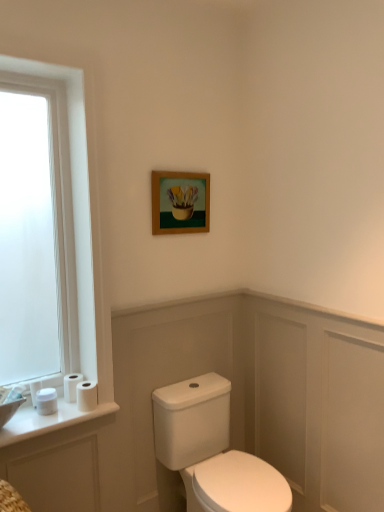
Question: Considering the relative positions of wooden frame at upper center and white glossy porcelain at center in the image provided, is wooden frame at upper center in front of white glossy porcelain at center?

Choices:
 (A) yes
 (B) no

Answer: (B)

Question: Is wooden frame at upper center not near white glossy porcelain at center?

Choices:
 (A) yes
 (B) no

Answer: (B)

Question: Is wooden frame at upper center oriented away from white glossy porcelain at center?

Choices:
 (A) yes
 (B) no

Answer: (B)

Question: Can you confirm if wooden frame at upper center is positioned to the right of white glossy porcelain at center?

Choices:
 (A) no
 (B) yes

Answer: (A)

Question: From the image's perspective, is wooden frame at upper center under white glossy porcelain at center?

Choices:
 (A) no
 (B) yes

Answer: (A)

Question: Does point (66, 376) appear closer or farther from the camera than point (36, 382)?

Choices:
 (A) closer
 (B) farther

Answer: (B)

Question: In the image, is white matte toilet paper at lower left, which ranks as the third toilet paper in left-to-right order, on the left side or the right side of white matte toilet paper at lower left, which appears as the 1th toilet paper when viewed from the left?

Choices:
 (A) left
 (B) right

Answer: (B)

Question: Considering the positions of white matte toilet paper at lower left, which ranks as the third toilet paper in left-to-right order, and white matte toilet paper at lower left, the fourth toilet paper when ordered from right to left, in the image, is white matte toilet paper at lower left, which ranks as the third toilet paper in left-to-right order, wider or thinner than white matte toilet paper at lower left, the fourth toilet paper when ordered from right to left,?

Choices:
 (A) thin
 (B) wide

Answer: (B)

Question: Is white matte toilet paper at lower left, which ranks as the third toilet paper in left-to-right order, in front of or behind white matte toilet paper at lower left, which appears as the 1th toilet paper when viewed from the left, in the image?

Choices:
 (A) behind
 (B) front

Answer: (A)

Question: Considering the positions of white matte toilet paper at lower left, which appears as the 1th toilet paper when viewed from the left, and white frosted glass window at left in the image, is white matte toilet paper at lower left, which appears as the 1th toilet paper when viewed from the left, taller or shorter than white frosted glass window at left?

Choices:
 (A) short
 (B) tall

Answer: (A)

Question: Looking at their shapes, would you say white matte toilet paper at lower left, the fourth toilet paper when ordered from right to left, is wider or thinner than white frosted glass window at left?

Choices:
 (A) thin
 (B) wide

Answer: (A)

Question: Considering their positions, is white matte toilet paper at lower left, which appears as the 1th toilet paper when viewed from the left, located in front of or behind white frosted glass window at left?

Choices:
 (A) behind
 (B) front

Answer: (A)

Question: Is point (36, 389) positioned closer to the camera than point (76, 79)?

Choices:
 (A) closer
 (B) farther

Answer: (B)

Question: In terms of width, does white matte toilet paper at lower left, which appears as the 1th toilet paper when viewed from the left, look wider or thinner when compared to white matte toilet paper at lower left, acting as the second toilet paper starting from the right?

Choices:
 (A) thin
 (B) wide

Answer: (A)

Question: Is white matte toilet paper at lower left, which appears as the 1th toilet paper when viewed from the left, in front of or behind white matte toilet paper at lower left, which ranks as the third toilet paper in left-to-right order, in the image?

Choices:
 (A) front
 (B) behind

Answer: (A)